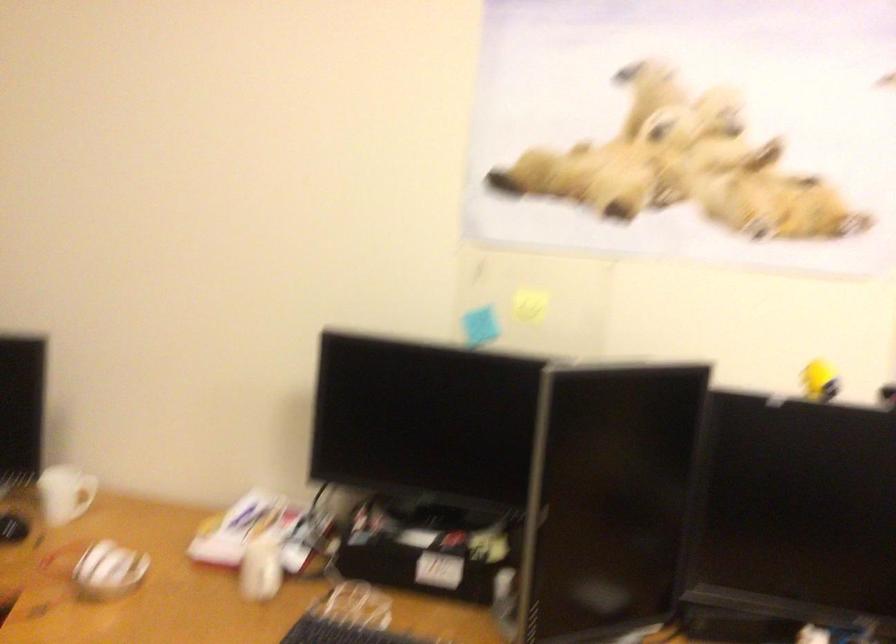
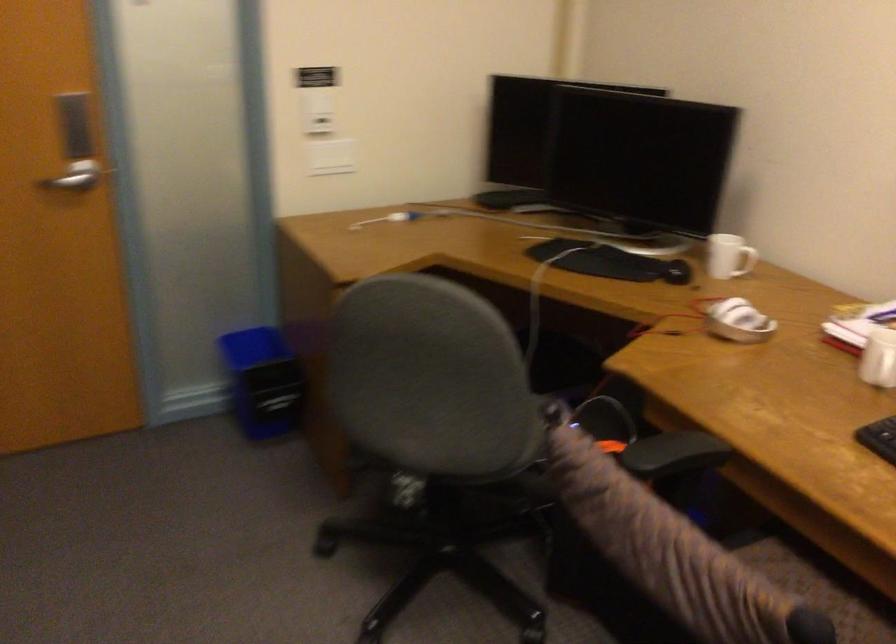
The point at (90, 500) is marked in the first image. Where is the corresponding point in the second image?

(745, 261)